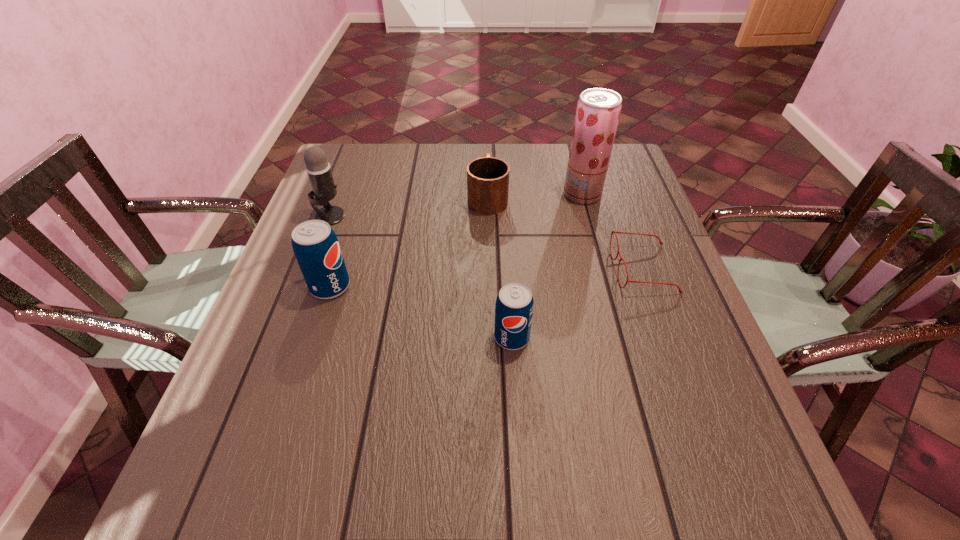
Where is `the fourth shortest object`? the fourth shortest object is located at coordinates (316, 247).

Where is `the left pop`? The height and width of the screenshot is (540, 960). the left pop is located at coordinates (316, 247).

Where is `the right pop`? The height and width of the screenshot is (540, 960). the right pop is located at coordinates (514, 306).

Identify the location of the nearer pop. The image size is (960, 540). (514, 306).

Image resolution: width=960 pixels, height=540 pixels. What are the coordinates of `the tallest object` in the screenshot? It's located at (598, 110).

You are a GUI agent. You are given a task and a screenshot of the screen. Output one action in this format:
    pyautogui.click(x=<x>, y=<y>)
    Task: Click on the spectacles
    This screenshot has width=960, height=540.
    Given the screenshot: What is the action you would take?
    tap(615, 232)

The height and width of the screenshot is (540, 960). I want to click on the fifth shortest object, so click(x=318, y=168).

I want to click on the second shortest object, so click(487, 177).

This screenshot has width=960, height=540. What are the coordinates of `free location located on the front of the fourth shortest object` in the screenshot? It's located at (285, 428).

Locate an element on the screen. free space located on the right of the right pop is located at coordinates (579, 338).